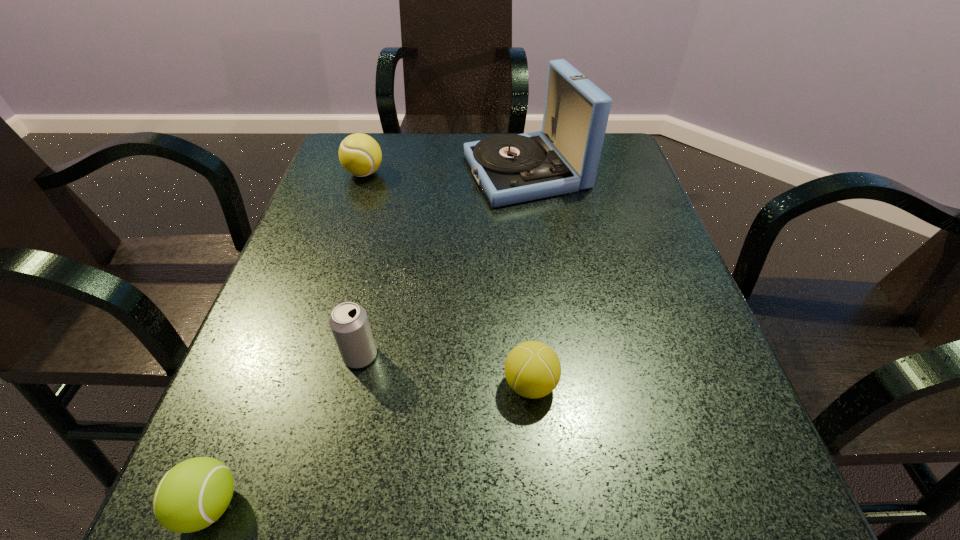
This screenshot has height=540, width=960. In order to click on tennis ball that can be found as the closest to the tallest object in this screenshot , I will do `click(360, 155)`.

The height and width of the screenshot is (540, 960). I want to click on free location that satisfies the following two spatial constraints: 1. on the back side of the farthest tennis ball; 2. on the left side of the tallest object, so click(x=365, y=172).

At what (x,y) coordinates should I click in order to perform the action: click on free space that satisfies the following two spatial constraints: 1. on the front side of the second nearest tennis ball; 2. on the left side of the farthest tennis ball. Please return your answer as a coordinate pair (x, y). Image resolution: width=960 pixels, height=540 pixels. Looking at the image, I should click on (296, 384).